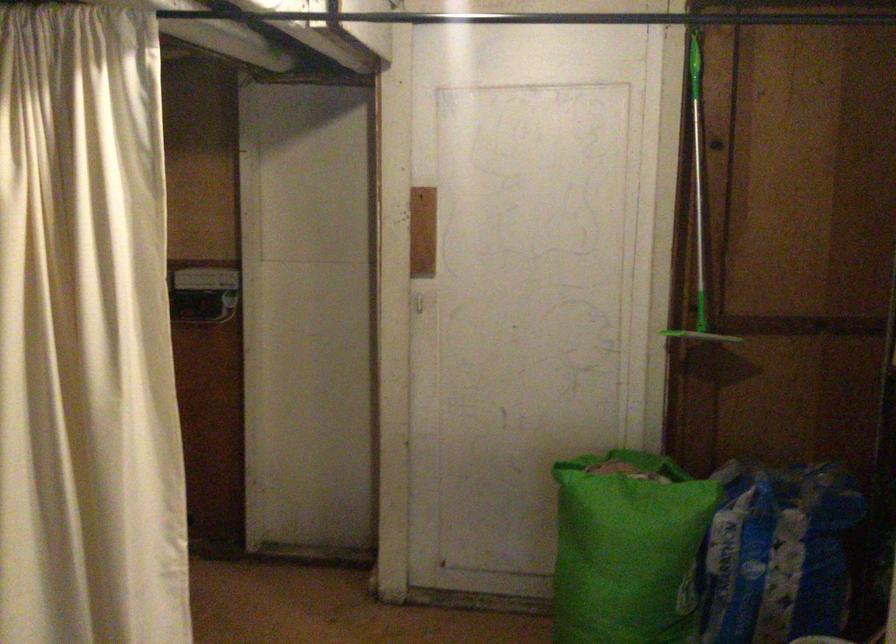
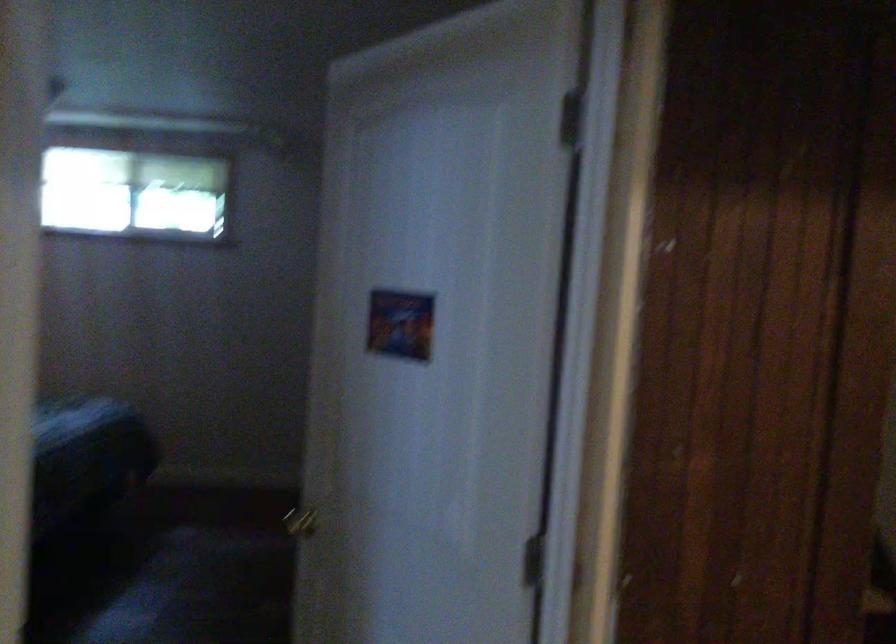
Question: Based on the continuous images, in which direction is the camera rotating? Reply with the corresponding letter.

Choices:
 (A) Left
 (B) Right
 (C) Up
 (D) Down

Answer: (A)